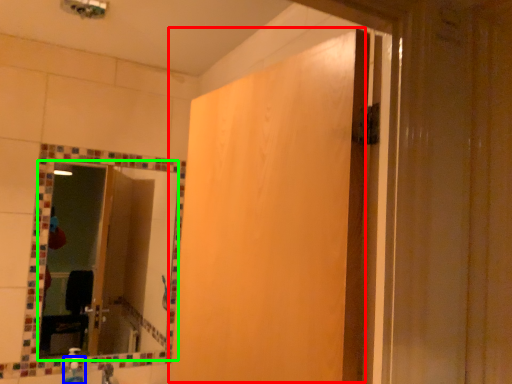
Question: Which is nearer to the screen door (highlighted by a red box)? soap dispenser (highlighted by a blue box) or mirror (highlighted by a green box).

Choices:
 (A) soap dispenser
 (B) mirror

Answer: (B)